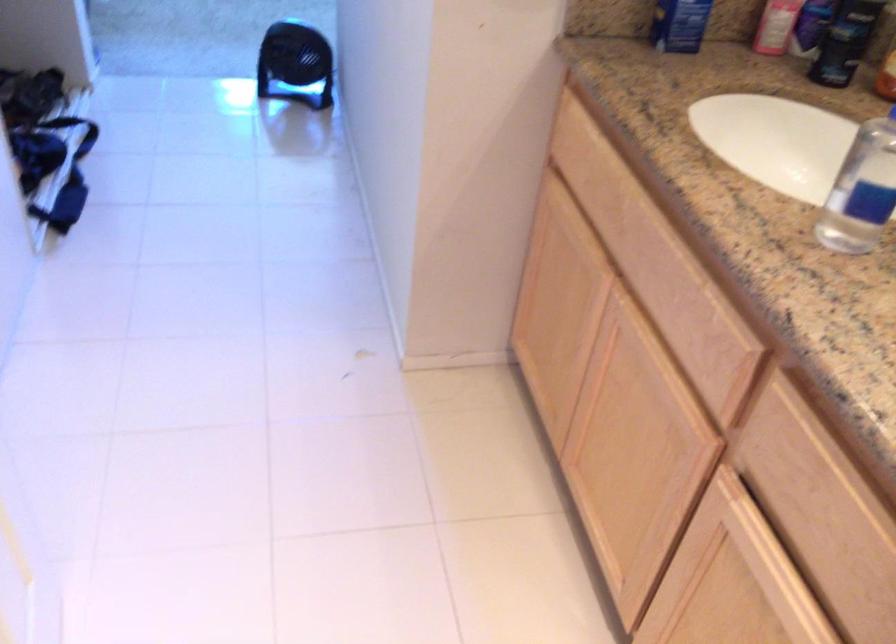
Find where to push the dispenser pump. Please return your answer as a coordinate pair (x, y).

(295, 64)